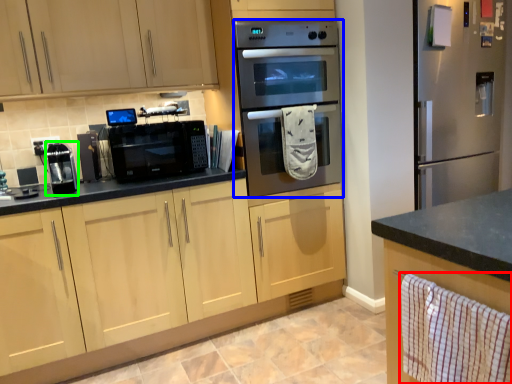
Question: Which object is positioned closest to hand towel (highlighted by a red box)? Select from microwave oven (highlighted by a blue box) and appliance (highlighted by a green box).

Choices:
 (A) microwave oven
 (B) appliance

Answer: (A)